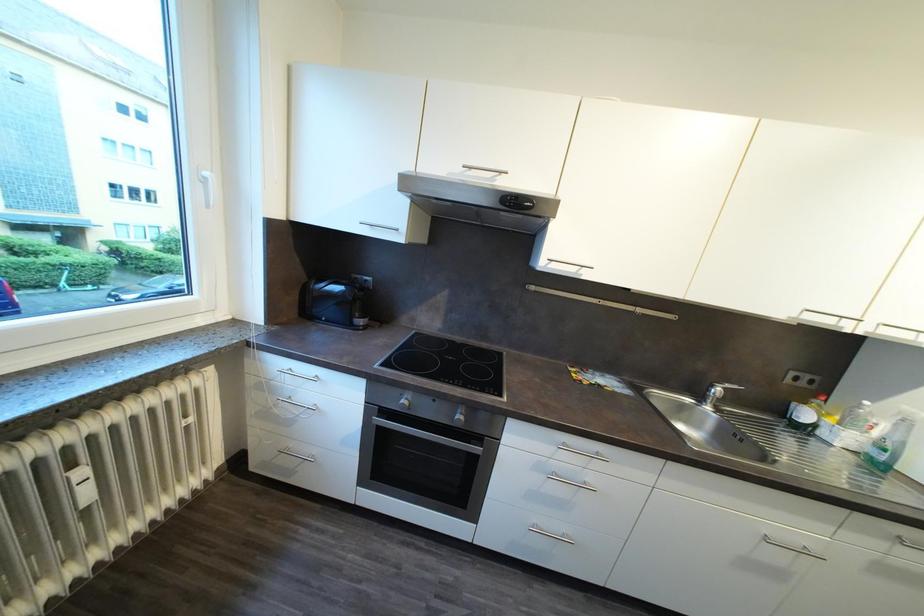
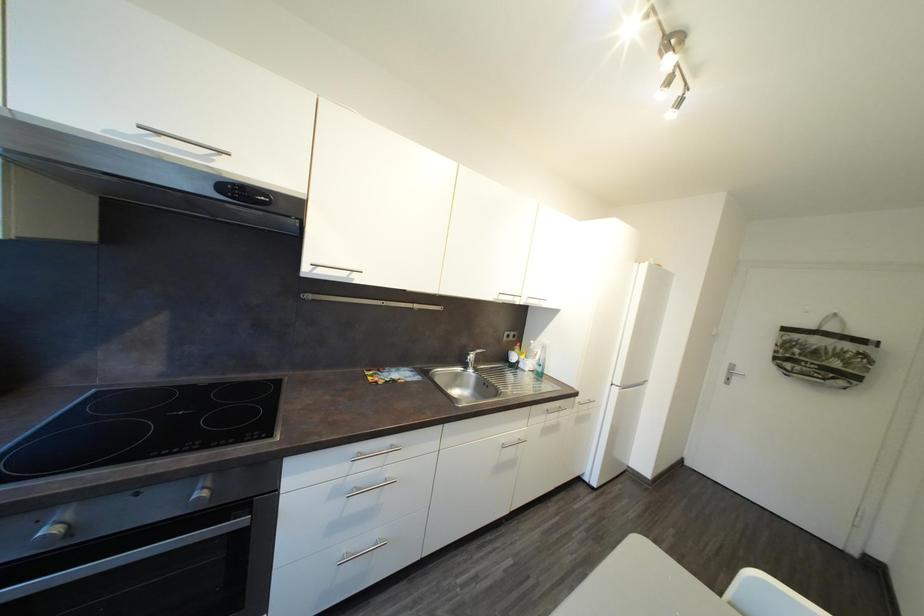
Question: The images are taken continuously from a first-person perspective. In which direction is your viewpoint rotating?

Choices:
 (A) Left
 (B) Right
 (C) Up
 (D) Down

Answer: (B)